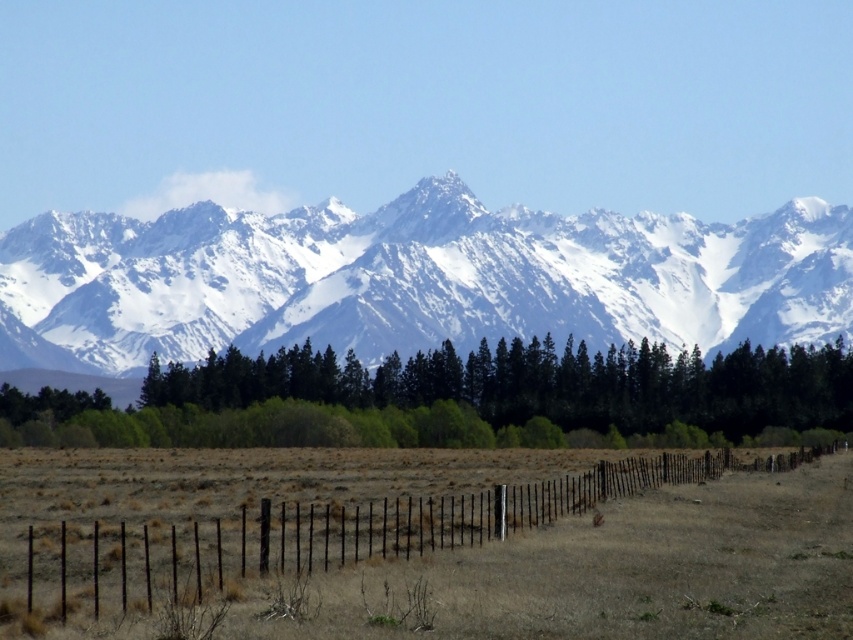
Question: Is snowy granite mountain range at upper center to the left of green leafy trees at center from the viewer's perspective?

Choices:
 (A) yes
 (B) no

Answer: (A)

Question: Which of the following is the farthest from the observer?

Choices:
 (A) [x=349, y=387]
 (B) [x=4, y=340]
 (C) [x=785, y=540]

Answer: (B)

Question: Considering the real-world distances, which object is farthest from the snowy granite mountain range at upper center?

Choices:
 (A) black wire fence at lower center
 (B) green leafy trees at center

Answer: (A)

Question: Among these points, which one is nearest to the camera?

Choices:
 (A) (720, 280)
 (B) (212, 384)

Answer: (B)

Question: Can you confirm if snowy granite mountain range at upper center is positioned to the left of green leafy trees at center?

Choices:
 (A) no
 (B) yes

Answer: (B)

Question: Is snowy granite mountain range at upper center thinner than green leafy trees at center?

Choices:
 (A) no
 (B) yes

Answer: (A)